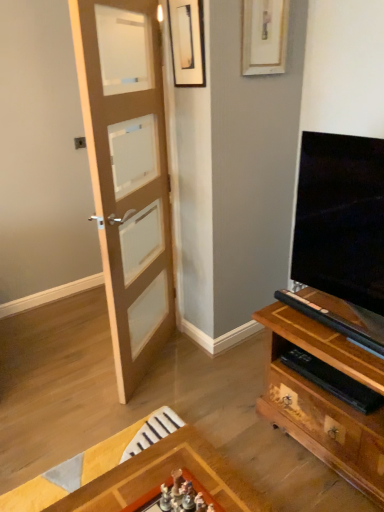
Question: Visually, is matte black picture frame at upper center, the 1th picture frame in the left-to-right sequence, positioned to the left or to the right of light brown wooden door at left?

Choices:
 (A) left
 (B) right

Answer: (B)

Question: In terms of width, does matte black picture frame at upper center, the 1th picture frame in the left-to-right sequence, look wider or thinner when compared to light brown wooden door at left?

Choices:
 (A) thin
 (B) wide

Answer: (A)

Question: Which object is positioned farthest from the wooden picture frame at upper center, the first picture frame when ordered from right to left?

Choices:
 (A) matte black picture frame at upper center, the 1th picture frame in the left-to-right sequence
 (B) light brown wooden door at left

Answer: (B)

Question: Considering the real-world distances, which object is closest to the wooden picture frame at upper center, the first picture frame when ordered from right to left?

Choices:
 (A) matte black picture frame at upper center, the 2th picture frame when ordered from right to left
 (B) light brown wooden door at left

Answer: (A)